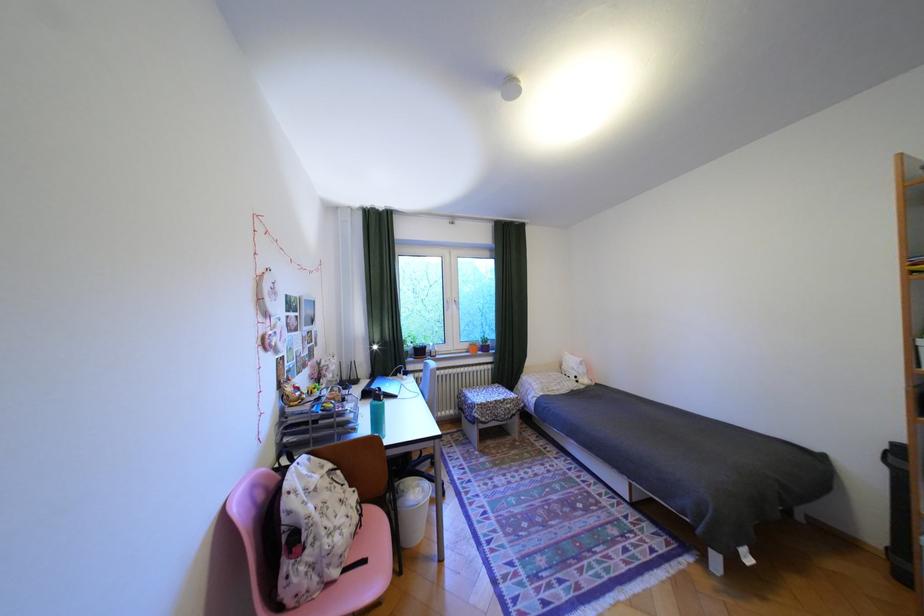
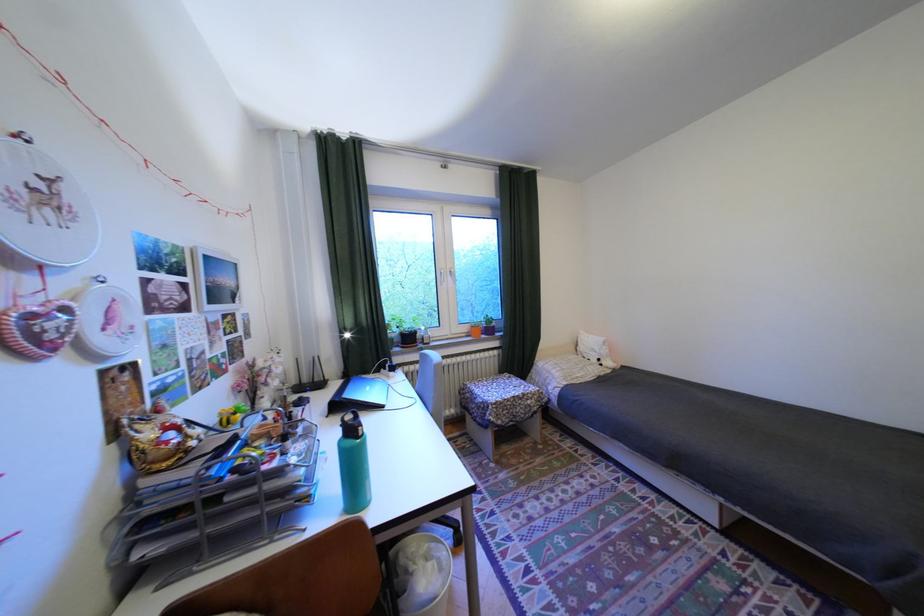
Question: The camera is either moving clockwise (left) or counter-clockwise (right) around the object. The first image is from the beginning of the video and the second image is from the end. Is the camera moving left or right when shooting the video?

Choices:
 (A) Left
 (B) Right

Answer: (A)